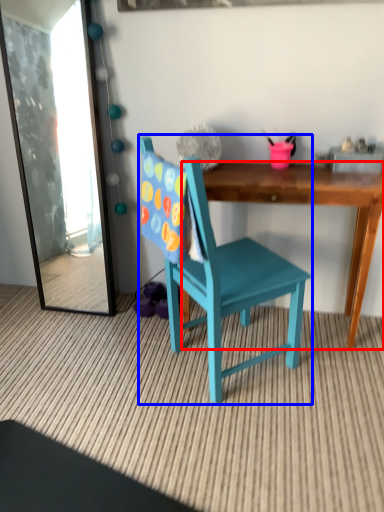
Question: Among these objects, which one is nearest to the camera, desk (highlighted by a red box) or chair (highlighted by a blue box)?

Choices:
 (A) desk
 (B) chair

Answer: (B)